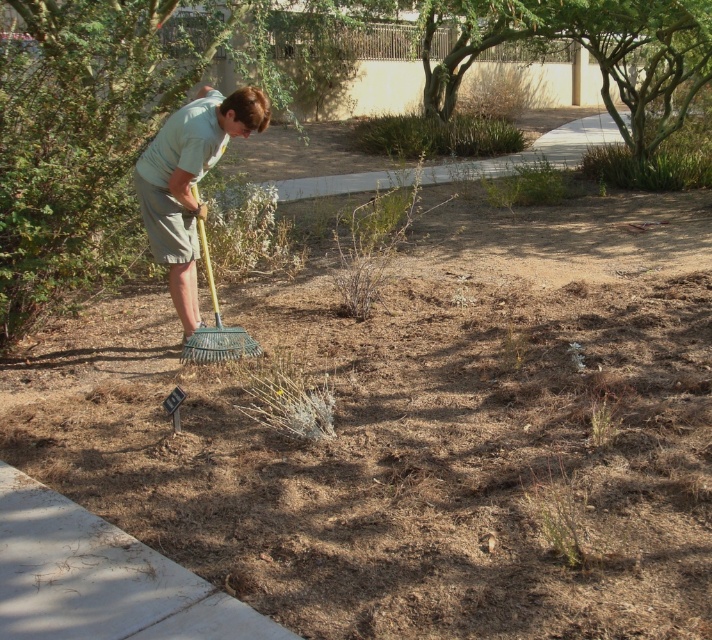
You are a gardener looking at the scene. You need to determine the position of the light green fabric at upper left relative to the metallic green rake at center. Which object is higher in the image?

The light green fabric at upper left is above the metallic green rake at center, so it is higher in the image.

You are a gardener who needs to decide which item to use first. The light green fabric at upper left and the metallic green rake at center are both in your view. Which item is bigger in size?

The light green fabric at upper left is larger in size than the metallic green rake at center.